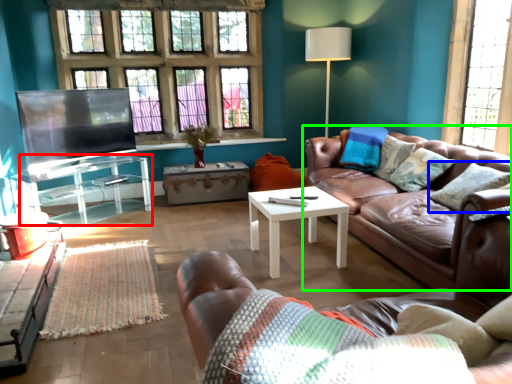
Question: Based on their relative distances, which object is farther from table (highlighted by a red box)? Choose from pillow (highlighted by a blue box) and studio couch (highlighted by a green box).

Choices:
 (A) pillow
 (B) studio couch

Answer: (A)